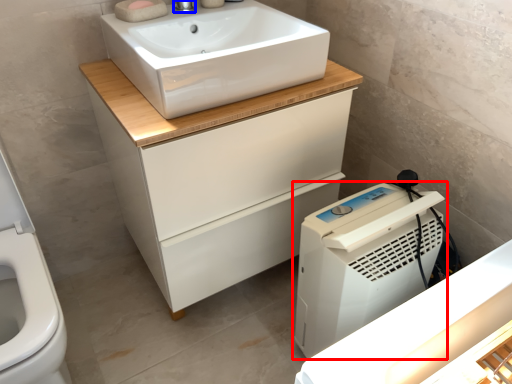
Question: Which object is closer to the camera taking this photo, home appliance (highlighted by a red box) or tap (highlighted by a blue box)?

Choices:
 (A) home appliance
 (B) tap

Answer: (A)